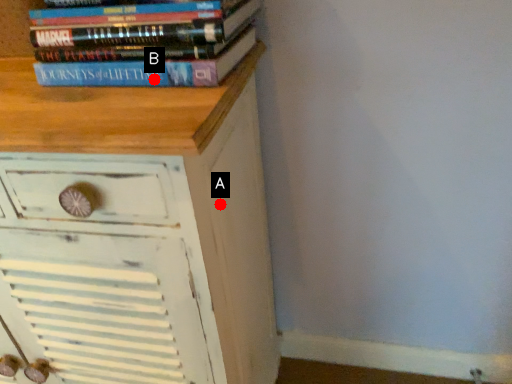
Question: Two points are circled on the image, labeled by A and B beside each circle. Which point is further to the camera?

Choices:
 (A) A is further
 (B) B is further

Answer: (A)